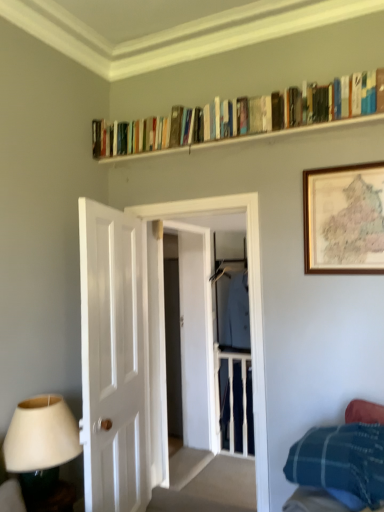
Locate an element on the screen. This screenshot has width=384, height=512. hardcover books at upper center is located at coordinates (249, 117).

The width and height of the screenshot is (384, 512). Describe the element at coordinates (114, 359) in the screenshot. I see `white glossy door at left` at that location.

Where is `wooden bookshelf at upper center`? The width and height of the screenshot is (384, 512). wooden bookshelf at upper center is located at coordinates (248, 138).

Locate an element on the screen. The width and height of the screenshot is (384, 512). transparent glass door at center is located at coordinates (250, 297).

The image size is (384, 512). What are the coordinates of `blue plaid blanket at lower right` in the screenshot? It's located at click(340, 463).

Where is `matte white lampshade at lower left`? The image size is (384, 512). matte white lampshade at lower left is located at coordinates (39, 438).

Is blue plaid blanket at lower right bigger than hardcover books at upper center?

Yes, blue plaid blanket at lower right is bigger than hardcover books at upper center.

Is blue plaid blanket at lower right placed right next to hardcover books at upper center?

They are not placed beside each other.

Considering the sizes of objects blue plaid blanket at lower right and hardcover books at upper center in the image provided, who is wider, blue plaid blanket at lower right or hardcover books at upper center?

blue plaid blanket at lower right.

Which object is thinner, light blue fabric coat at center or hardcover books at upper center?

With smaller width is light blue fabric coat at center.

Is hardcover books at upper center at the back of light blue fabric coat at center?

No, light blue fabric coat at center is not facing away from hardcover books at upper center.

Which point is more forward, (237, 362) or (178, 146)?

The point (178, 146) is in front.

How many degrees apart are the facing directions of light blue fabric coat at center and hardcover books at upper center?

89.5 degrees separate the facing orientations of light blue fabric coat at center and hardcover books at upper center.

Between light blue fabric coat at center and matte white lampshade at lower left, which one has smaller width?

With smaller width is light blue fabric coat at center.

Is light blue fabric coat at center located outside matte white lampshade at lower left?

Yes, light blue fabric coat at center is not within matte white lampshade at lower left.

Can you confirm if light blue fabric coat at center is bigger than matte white lampshade at lower left?

Indeed, light blue fabric coat at center has a larger size compared to matte white lampshade at lower left.

Is wooden bookshelf at upper center to the left or to the right of blue plaid blanket at lower right in the image?

Based on their positions, wooden bookshelf at upper center is located to the left of blue plaid blanket at lower right.

Is wooden bookshelf at upper center inside or outside of blue plaid blanket at lower right?

wooden bookshelf at upper center is not inside blue plaid blanket at lower right, it's outside.

Can you see wooden bookshelf at upper center touching blue plaid blanket at lower right?

There is a gap between wooden bookshelf at upper center and blue plaid blanket at lower right.

Between wooden bookshelf at upper center and blue plaid blanket at lower right, which one has more height?

blue plaid blanket at lower right is taller.

From a real-world perspective, is hardcover books at upper center beneath wooden bookshelf at upper center?

No, from a real-world perspective, hardcover books at upper center is not under wooden bookshelf at upper center.

In the image, is hardcover books at upper center on the left side or the right side of wooden bookshelf at upper center?

In the image, hardcover books at upper center appears on the left side of wooden bookshelf at upper center.

From the image's perspective, is hardcover books at upper center above or below wooden bookshelf at upper center?

Based on their image positions, hardcover books at upper center is located above wooden bookshelf at upper center.

Is blue plaid blanket at lower right to the right of light blue fabric coat at center from the viewer's perspective?

Yes, blue plaid blanket at lower right is to the right of light blue fabric coat at center.

Relative to light blue fabric coat at center, is blue plaid blanket at lower right in front or behind?

blue plaid blanket at lower right is in front of light blue fabric coat at center.

Is blue plaid blanket at lower right inside the boundaries of light blue fabric coat at center, or outside?

blue plaid blanket at lower right lies outside light blue fabric coat at center.

Is blue plaid blanket at lower right bigger or smaller than light blue fabric coat at center?

blue plaid blanket at lower right is bigger than light blue fabric coat at center.

From the image's perspective, who appears lower, blue plaid blanket at lower right or wooden bookshelf at upper center?

blue plaid blanket at lower right is shown below in the image.

In terms of width, does blue plaid blanket at lower right look wider or thinner when compared to wooden bookshelf at upper center?

blue plaid blanket at lower right is wider than wooden bookshelf at upper center.

How many degrees apart are the facing directions of blue plaid blanket at lower right and wooden bookshelf at upper center?

The facing directions of blue plaid blanket at lower right and wooden bookshelf at upper center are 0.706 degrees apart.

Identify the location of book behind the blue plaid blanket at lower right. The image size is (384, 512). (249, 117).

The width and height of the screenshot is (384, 512). I want to click on clothing below the hardcover books at upper center (from the image's perspective), so click(x=237, y=316).

Considering their positions, is matte white lampshade at lower left positioned closer to hardcover books at upper center than wooden framed map at upper right?

wooden framed map at upper right lies closer to hardcover books at upper center than the other object.

Which object lies nearer to the anchor point wooden bookshelf at upper center, light blue fabric coat at center or blue plaid blanket at lower right?

Among the two, blue plaid blanket at lower right is located nearer to wooden bookshelf at upper center.

Looking at the image, which one is located closer to hardcover books at upper center, white glossy door at left or wooden bookshelf at upper center?

Based on the image, wooden bookshelf at upper center appears to be nearer to hardcover books at upper center.

Estimate the real-world distances between objects in this image. Which object is closer to hardcover books at upper center, light blue fabric coat at center or white glossy door at left?

Among the two, white glossy door at left is located nearer to hardcover books at upper center.

When comparing their distances from wooden bookshelf at upper center, does transparent glass door at center or matte white lampshade at lower left seem further?

The object further to wooden bookshelf at upper center is matte white lampshade at lower left.

When comparing their distances from wooden bookshelf at upper center, does hardcover books at upper center or light blue fabric coat at center seem closer?

hardcover books at upper center is closer to wooden bookshelf at upper center.

Looking at the image, which one is located further to light blue fabric coat at center, blue plaid blanket at lower right or transparent glass door at center?

Based on the image, blue plaid blanket at lower right appears to be further to light blue fabric coat at center.

Considering their positions, is white glossy door at left positioned further to light blue fabric coat at center than wooden framed map at upper right?

wooden framed map at upper right is further to light blue fabric coat at center.

Find the location of `picture frame between white glossy door at left and light blue fabric coat at center along the z-axis`. picture frame between white glossy door at left and light blue fabric coat at center along the z-axis is located at coordinates (344, 219).

At what (x,y) coordinates should I click in order to perform the action: click on picture frame that lies between hardcover books at upper center and transparent glass door at center from top to bottom. Please return your answer as a coordinate pair (x, y). This screenshot has height=512, width=384. Looking at the image, I should click on (344, 219).

At what (x,y) coordinates should I click in order to perform the action: click on glass door located between matte white lampshade at lower left and light blue fabric coat at center in the depth direction. Please return your answer as a coordinate pair (x, y). The width and height of the screenshot is (384, 512). Looking at the image, I should click on (250, 297).

The image size is (384, 512). I want to click on glass door between wooden bookshelf at upper center and blue plaid blanket at lower right in the vertical direction, so 250,297.